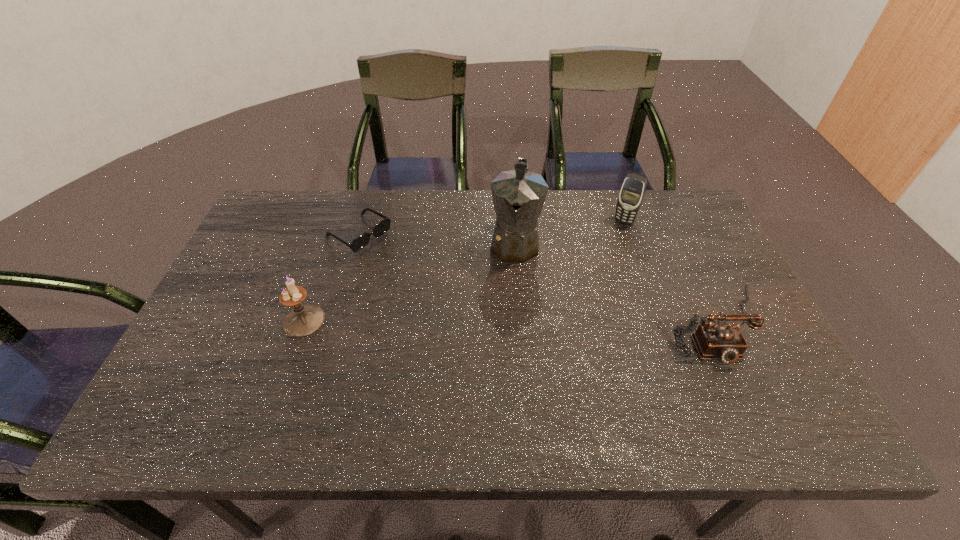
Find the location of `free space between the coffeepot and the candle holder`. free space between the coffeepot and the candle holder is located at coordinates (409, 281).

Find the location of a particular element. The image size is (960, 540). free space between the sunglasses and the candle holder is located at coordinates (331, 277).

At what (x,y) coordinates should I click in order to perform the action: click on empty location between the third object from left to right and the cellular telephone. Please return your answer as a coordinate pair (x, y). The height and width of the screenshot is (540, 960). Looking at the image, I should click on (569, 232).

Image resolution: width=960 pixels, height=540 pixels. Identify the location of free point between the telephone and the shortest object. (538, 279).

You are a GUI agent. You are given a task and a screenshot of the screen. Output one action in this format:
    pyautogui.click(x=<x>, y=<y>)
    Task: Click on the empty location between the sunglasses and the fourth tallest object
    This screenshot has height=540, width=960.
    Given the screenshot: What is the action you would take?
    pyautogui.click(x=538, y=279)

The image size is (960, 540). I want to click on free space between the shortest object and the tallest object, so coord(437,238).

Find the location of a particular element. This screenshot has height=540, width=960. free space between the candle holder and the shortest object is located at coordinates (331, 277).

Identify the location of free space between the telephone and the candle holder. (510, 322).

The width and height of the screenshot is (960, 540). What are the coordinates of `the second closest object to the tallest object` in the screenshot? It's located at (725, 342).

This screenshot has width=960, height=540. I want to click on object identified as the second closest to the coffeepot, so click(x=725, y=342).